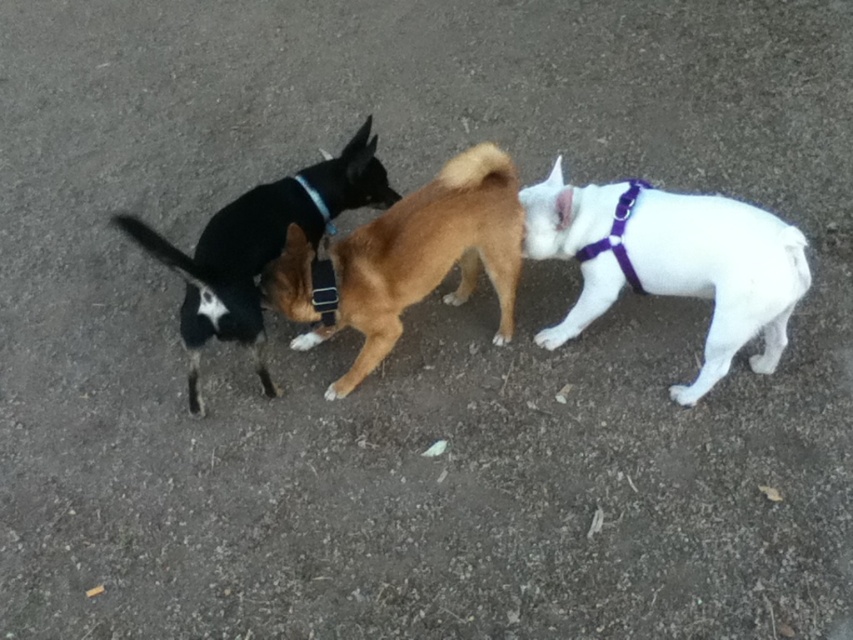
Is white matte harness at right shorter than black matte neckband at center?

No, white matte harness at right is not shorter than black matte neckband at center.

Is point (527, 248) closer to viewer compared to point (321, 209)?

Yes.

Find the location of a particular element. white matte harness at right is located at coordinates (718, 273).

Can you confirm if brown leather dog at center is positioned to the right of black leather dog at center?

Yes, brown leather dog at center is to the right of black leather dog at center.

Which is more to the left, brown leather dog at center or black leather dog at center?

Positioned to the left is black leather dog at center.

Which is behind, point (293, 224) or point (253, 202)?

Positioned behind is point (293, 224).

Locate an element on the screen. The image size is (853, 640). brown leather dog at center is located at coordinates (425, 257).

Does brown leather dog at center have a greater width compared to black matte neckband at center?

Yes.

Which is in front, point (347, 310) or point (328, 225)?

Point (347, 310)

Find the location of `brown leather dog at center`. brown leather dog at center is located at coordinates (425, 257).

This screenshot has width=853, height=640. I want to click on brown leather dog at center, so click(x=425, y=257).